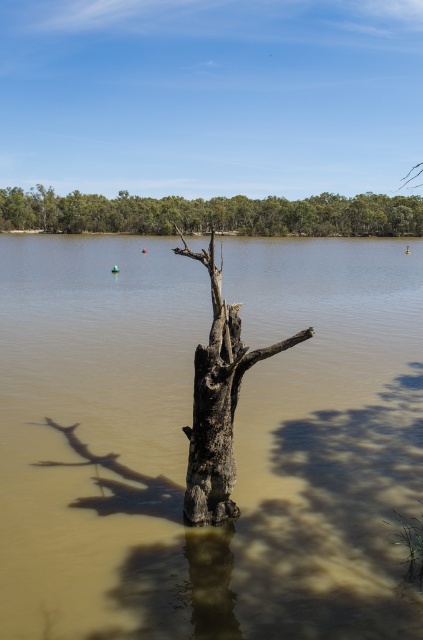
You are a kayaker paddling towards the charcoal rough tree trunk at center. As you look up, you notice the green leafy trees at upper center. Which object will appear closer to you in your line of sight?

The green leafy trees at upper center will appear closer to you because they are positioned further to the viewer than the charcoal rough tree trunk at center, meaning they are nearer in your line of sight.

You are an environmental scientist assessing the scene. You need to determine which object occupies more horizontal space in the image. Which is wider, the green leafy trees at upper center or the charcoal rough tree trunk at center?

The green leafy trees at upper center are wider than the charcoal rough tree trunk at center, as their width surpasses that of the trunk.